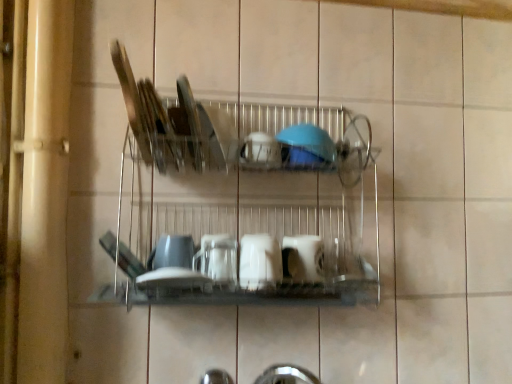
Measure the distance between point (200, 125) and camera.

Point (200, 125) and camera are 32.99 inches apart from each other.

The height and width of the screenshot is (384, 512). I want to click on matte white cup at center, the 5th tableware from the top, so click(x=174, y=251).

At what (x,y) coordinates should I click in order to perform the action: click on clear glass plate at center, the 1th tableware when ordered from top to bottom. Please return your answer as a coordinate pair (x, y). The width and height of the screenshot is (512, 384). Looking at the image, I should click on (210, 137).

Is clear glass plate at center, the 6th tableware from the bottom, at the back of blue matte bowl at upper center, the second tableware when ordered from top to bottom?

No, blue matte bowl at upper center, the second tableware when ordered from top to bottom, is not facing away from clear glass plate at center, the 6th tableware from the bottom.

From the image's perspective, who appears lower, blue matte bowl at upper center, the second tableware when ordered from top to bottom, or clear glass plate at center, the 1th tableware when ordered from top to bottom?

blue matte bowl at upper center, the second tableware when ordered from top to bottom, from the image's perspective.

Measure the distance between blue matte bowl at upper center, the second tableware when ordered from top to bottom, and clear glass plate at center, the 1th tableware when ordered from top to bottom.

The distance of blue matte bowl at upper center, the second tableware when ordered from top to bottom, from clear glass plate at center, the 1th tableware when ordered from top to bottom, is 16.59 centimeters.

Which is behind, point (310, 146) or point (219, 166)?

The point (219, 166) is behind.

Is blue matte bowl at upper center, the 5th tableware in the bottom-to-top sequence, surrounded by clear glass plate at center, the 1th tableware when ordered from top to bottom?

Actually, blue matte bowl at upper center, the 5th tableware in the bottom-to-top sequence, is outside clear glass plate at center, the 1th tableware when ordered from top to bottom.

Who is bigger, clear glass plate at center, the 6th tableware from the bottom, or blue matte bowl at upper center, the second tableware when ordered from top to bottom?

blue matte bowl at upper center, the second tableware when ordered from top to bottom, is bigger.

Considering the relative sizes of clear glass plate at center, the 6th tableware from the bottom, and blue matte bowl at upper center, the second tableware when ordered from top to bottom, in the image provided, is clear glass plate at center, the 6th tableware from the bottom, shorter than blue matte bowl at upper center, the second tableware when ordered from top to bottom,?

No.

Starting from the metallic silver dish rack at center, which tableware is the 3rd one to the right? Please provide its 2D coordinates.

[(303, 258)]

Is point (267, 121) closer to viewer compared to point (305, 260)?

No, it is not.

Is metallic silver dish rack at center facing away from white glossy cup at center, the 6th tableware positioned from the top?

Yes, metallic silver dish rack at center's orientation is away from white glossy cup at center, the 6th tableware positioned from the top.

Considering the points (213, 159) and (270, 157), which point is in front, point (213, 159) or point (270, 157)?

The point (270, 157) is in front.

Which of these two, clear glass plate at center, the 6th tableware from the bottom, or blue glossy bowl at center, the 3th tableware from the top, is thinner?

blue glossy bowl at center, the 3th tableware from the top.

From a real-world perspective, is clear glass plate at center, the 6th tableware from the bottom, positioned above or below blue glossy bowl at center, the 3th tableware from the top?

In terms of real-world spatial position, clear glass plate at center, the 6th tableware from the bottom, is above blue glossy bowl at center, the 3th tableware from the top.

Measure the distance between clear glass plate at center, the 6th tableware from the bottom, and blue glossy bowl at center, the 3th tableware from the top.

clear glass plate at center, the 6th tableware from the bottom, is 7.81 centimeters from blue glossy bowl at center, the 3th tableware from the top.

From the image's perspective, does white glossy cup at center, the 6th tableware positioned from the top, appear lower than white glossy cup at center, which is the 4th tableware in top-to-bottom order?

Correct, white glossy cup at center, the 6th tableware positioned from the top, appears lower than white glossy cup at center, which is the 4th tableware in top-to-bottom order, in the image.

Which of these two, white glossy cup at center, which is the 1th tableware from bottom to top, or white glossy cup at center, the third tableware in the bottom-to-top sequence, is smaller?

white glossy cup at center, which is the 1th tableware from bottom to top.

From the picture: Is white glossy cup at center, the 6th tableware positioned from the top, next to white glossy cup at center, which is the 4th tableware in top-to-bottom order, and touching it?

Yes, white glossy cup at center, the 6th tableware positioned from the top, is next to white glossy cup at center, which is the 4th tableware in top-to-bottom order.

From a real-world perspective, is white glossy cup at center, the 6th tableware positioned from the top, under white glossy cup at center, the third tableware in the bottom-to-top sequence?

Yes, from a real-world perspective, white glossy cup at center, the 6th tableware positioned from the top, is under white glossy cup at center, the third tableware in the bottom-to-top sequence.

Consider the image. Relative to blue glossy bowl at center, which ranks as the fourth tableware in bottom-to-top order, is matte white cup at center, the 5th tableware from the top, in front or behind?

Clearly, matte white cup at center, the 5th tableware from the top, is behind blue glossy bowl at center, which ranks as the fourth tableware in bottom-to-top order.

Does matte white cup at center, which ranks as the second tableware in bottom-to-top order, turn towards blue glossy bowl at center, the 3th tableware from the top?

No, matte white cup at center, which ranks as the second tableware in bottom-to-top order, is not aimed at blue glossy bowl at center, the 3th tableware from the top.

Is point (193, 248) less distant than point (278, 143)?

No.

Does matte white cup at center, the 5th tableware from the top, appear on the right side of blue glossy bowl at center, the 3th tableware from the top?

No, matte white cup at center, the 5th tableware from the top, is not to the right of blue glossy bowl at center, the 3th tableware from the top.

Looking at this image, is clear glass plate at center, the 6th tableware from the bottom, positioned in front of metallic silver dish rack at center?

No, clear glass plate at center, the 6th tableware from the bottom, is further to the viewer.

Considering the sizes of objects clear glass plate at center, the 1th tableware when ordered from top to bottom, and metallic silver dish rack at center in the image provided, who is shorter, clear glass plate at center, the 1th tableware when ordered from top to bottom, or metallic silver dish rack at center?

clear glass plate at center, the 1th tableware when ordered from top to bottom.

Is metallic silver dish rack at center completely or partially inside clear glass plate at center, the 1th tableware when ordered from top to bottom?

Definitely not — metallic silver dish rack at center is not inside clear glass plate at center, the 1th tableware when ordered from top to bottom.

From a real-world perspective, which tableware is the 1st one underneath the clear glass plate at center, the 6th tableware from the bottom? Please provide its 2D coordinates.

[(306, 146)]

Starting from the clear glass plate at center, the 6th tableware from the bottom, which tableware is the 4th one to the right? Please provide its 2D coordinates.

[(306, 146)]

Which object lies nearer to the anchor point blue matte bowl at upper center, the 5th tableware in the bottom-to-top sequence, clear glass plate at center, the 6th tableware from the bottom, or white glossy cup at center, the 6th tableware positioned from the top?

The object closer to blue matte bowl at upper center, the 5th tableware in the bottom-to-top sequence, is clear glass plate at center, the 6th tableware from the bottom.

From the image, which object appears to be nearer to clear glass plate at center, the 6th tableware from the bottom, matte white cup at center, which ranks as the second tableware in bottom-to-top order, or blue matte bowl at upper center, the second tableware when ordered from top to bottom?

blue matte bowl at upper center, the second tableware when ordered from top to bottom, is positioned closer to the anchor clear glass plate at center, the 6th tableware from the bottom.

Based on their spatial positions, is matte white cup at center, the 5th tableware from the top, or white glossy cup at center, which is the 4th tableware in top-to-bottom order, closer to white glossy cup at center, which is the 1th tableware from bottom to top?

white glossy cup at center, which is the 4th tableware in top-to-bottom order, is positioned closer to the anchor white glossy cup at center, which is the 1th tableware from bottom to top.

From the image, which object appears to be nearer to white glossy cup at center, which is the 4th tableware in top-to-bottom order, clear glass plate at center, the 6th tableware from the bottom, or white glossy cup at center, the 6th tableware positioned from the top?

white glossy cup at center, the 6th tableware positioned from the top.

Looking at the image, which one is located closer to clear glass plate at center, the 6th tableware from the bottom, white glossy cup at center, which is the 4th tableware in top-to-bottom order, or matte white cup at center, which ranks as the second tableware in bottom-to-top order?

The object closer to clear glass plate at center, the 6th tableware from the bottom, is matte white cup at center, which ranks as the second tableware in bottom-to-top order.

Which object lies further to the anchor point blue matte bowl at upper center, the 5th tableware in the bottom-to-top sequence, clear glass plate at center, the 6th tableware from the bottom, or metallic silver dish rack at center?

Among the two, metallic silver dish rack at center is located further to blue matte bowl at upper center, the 5th tableware in the bottom-to-top sequence.

Considering their positions, is clear glass plate at center, the 1th tableware when ordered from top to bottom, positioned closer to white glossy cup at center, the 6th tableware positioned from the top, than blue glossy bowl at center, which ranks as the fourth tableware in bottom-to-top order?

The object closer to white glossy cup at center, the 6th tableware positioned from the top, is blue glossy bowl at center, which ranks as the fourth tableware in bottom-to-top order.

Based on the photo, looking at the image, which one is located closer to clear glass plate at center, the 1th tableware when ordered from top to bottom, matte white cup at center, the 5th tableware from the top, or white glossy cup at center, the 6th tableware positioned from the top?

matte white cup at center, the 5th tableware from the top, is positioned closer to the anchor clear glass plate at center, the 1th tableware when ordered from top to bottom.

The width and height of the screenshot is (512, 384). I want to click on shelf between blue glossy bowl at center, the 3th tableware from the top, and white glossy cup at center, the third tableware in the bottom-to-top sequence, from top to bottom, so click(x=268, y=218).

Where is `shelf between clear glass plate at center, the 6th tableware from the bottom, and matte white cup at center, the 5th tableware from the top, in the vertical direction`? The height and width of the screenshot is (384, 512). shelf between clear glass plate at center, the 6th tableware from the bottom, and matte white cup at center, the 5th tableware from the top, in the vertical direction is located at coordinates (268, 218).

Image resolution: width=512 pixels, height=384 pixels. What are the coordinates of `shelf between blue matte bowl at upper center, the 5th tableware in the bottom-to-top sequence, and white glossy cup at center, which is the 1th tableware from bottom to top, from top to bottom` in the screenshot? It's located at (268, 218).

Find the location of a particular element. shelf between clear glass plate at center, the 1th tableware when ordered from top to bottom, and white glossy cup at center, the 6th tableware positioned from the top, vertically is located at coordinates (268, 218).